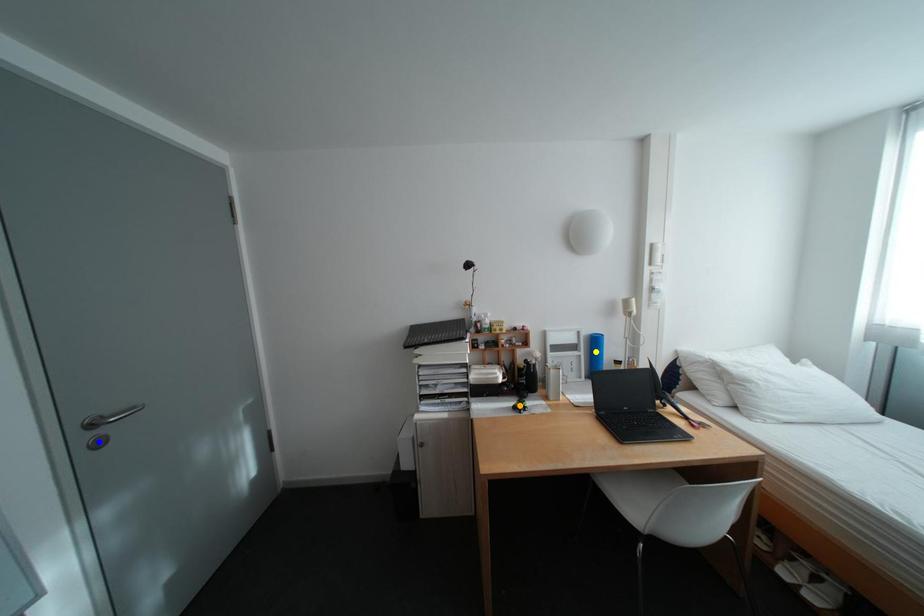
In the scene shown: Order these from nearest to farthest:
- blue point
- orange point
- yellow point

blue point → orange point → yellow point